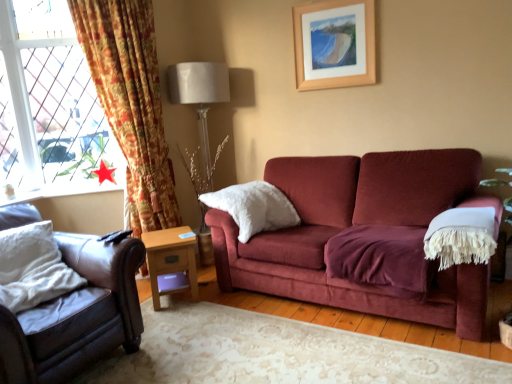
Question: Does floral fabric curtain at left contain light brown wooden side table at lower center?

Choices:
 (A) no
 (B) yes

Answer: (A)

Question: Can you confirm if floral fabric curtain at left is positioned to the right of light brown wooden side table at lower center?

Choices:
 (A) no
 (B) yes

Answer: (A)

Question: From a real-world perspective, does floral fabric curtain at left stand above light brown wooden side table at lower center?

Choices:
 (A) yes
 (B) no

Answer: (A)

Question: Can you confirm if floral fabric curtain at left is thinner than light brown wooden side table at lower center?

Choices:
 (A) no
 (B) yes

Answer: (A)

Question: Does floral fabric curtain at left have a smaller size compared to light brown wooden side table at lower center?

Choices:
 (A) no
 (B) yes

Answer: (A)

Question: Is the position of floral fabric curtain at left less distant than that of light brown wooden side table at lower center?

Choices:
 (A) no
 (B) yes

Answer: (B)

Question: Is white soft pillow at left, the 2th pillow from the right, smaller than light brown wooden side table at lower center?

Choices:
 (A) no
 (B) yes

Answer: (A)

Question: Is there a large distance between white soft pillow at left, the 2th pillow from the right, and light brown wooden side table at lower center?

Choices:
 (A) yes
 (B) no

Answer: (B)

Question: Can you confirm if white soft pillow at left, the 2th pillow from the right, is bigger than light brown wooden side table at lower center?

Choices:
 (A) yes
 (B) no

Answer: (A)

Question: Can you confirm if white soft pillow at left, which appears as the first pillow when viewed from the left, is taller than light brown wooden side table at lower center?

Choices:
 (A) no
 (B) yes

Answer: (A)

Question: From the image's perspective, is white soft pillow at left, the 2th pillow when ordered from back to front, over light brown wooden side table at lower center?

Choices:
 (A) yes
 (B) no

Answer: (A)

Question: Is white soft pillow at left, the 2th pillow from the right, not within light brown wooden side table at lower center?

Choices:
 (A) yes
 (B) no

Answer: (A)

Question: Is floral fabric curtain at left at the right side of wooden picture frame at upper center?

Choices:
 (A) yes
 (B) no

Answer: (B)